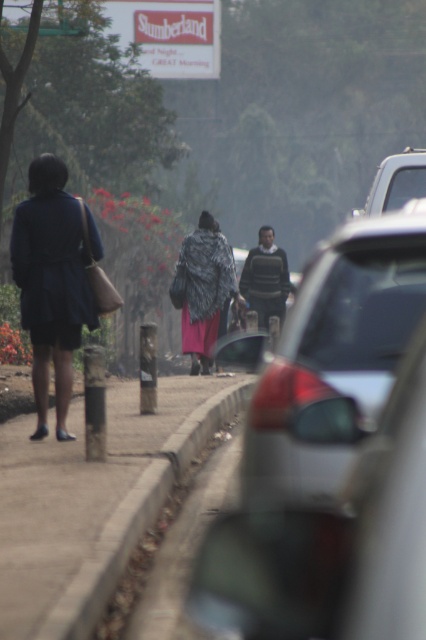
Is concrete pavement at lower left to the right of fluffy black coat at center from the viewer's perspective?

In fact, concrete pavement at lower left is to the left of fluffy black coat at center.

Identify the location of concrete pavement at lower left. The width and height of the screenshot is (426, 640). (94, 499).

Image resolution: width=426 pixels, height=640 pixels. Find the location of `fluffy black coat at center`. fluffy black coat at center is located at coordinates [x=203, y=289].

Who is higher up, fluffy black coat at center or metallic silver truck at right?

metallic silver truck at right

What do you see at coordinates (203, 289) in the screenshot? I see `fluffy black coat at center` at bounding box center [203, 289].

Locate an element on the screen. The image size is (426, 640). fluffy black coat at center is located at coordinates (203, 289).

Is point (290, 368) positioned behind point (377, 182)?

No, it is in front of (377, 182).

Does metallic gray car at center have a greater height compared to metallic silver truck at right?

In fact, metallic gray car at center may be shorter than metallic silver truck at right.

Is point (313, 280) positioned behind point (391, 157)?

No, (313, 280) is in front of (391, 157).

This screenshot has width=426, height=640. Identify the location of metallic gray car at center. (334, 355).